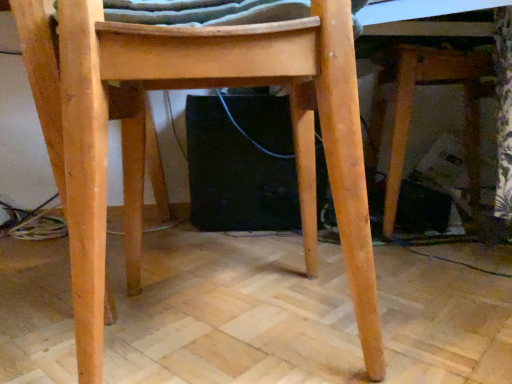
Question: Is natural wood table at lower right to the left or to the right of natural wood chair at center in the image?

Choices:
 (A) left
 (B) right

Answer: (B)

Question: From the image's perspective, is natural wood table at lower right positioned above or below natural wood chair at center?

Choices:
 (A) above
 (B) below

Answer: (A)

Question: From a real-world perspective, is natural wood table at lower right physically located above or below natural wood chair at center?

Choices:
 (A) below
 (B) above

Answer: (B)

Question: Is natural wood chair at center inside or outside of natural wood table at lower right?

Choices:
 (A) outside
 (B) inside

Answer: (A)

Question: From a real-world perspective, is natural wood chair at center above or below natural wood table at lower right?

Choices:
 (A) above
 (B) below

Answer: (B)

Question: Would you say natural wood chair at center is to the left or to the right of natural wood table at lower right in the picture?

Choices:
 (A) left
 (B) right

Answer: (A)

Question: Considering the positions of point (72, 264) and point (391, 64), is point (72, 264) closer or farther from the camera than point (391, 64)?

Choices:
 (A) closer
 (B) farther

Answer: (A)